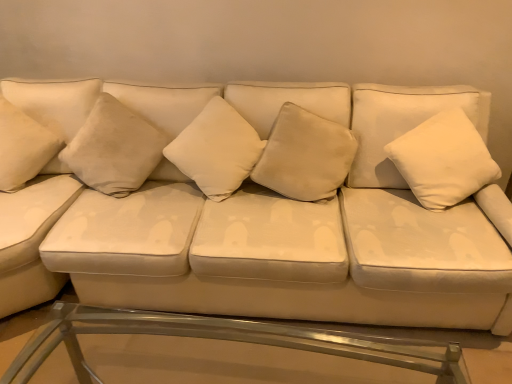
Question: From a real-world perspective, is suede-like beige pillow at center, the fourth pillow from the right, physically below suede white couch at center?

Choices:
 (A) no
 (B) yes

Answer: (A)

Question: Is suede-like beige pillow at center, which appears as the 2th pillow when viewed from the left, shorter than suede white couch at center?

Choices:
 (A) no
 (B) yes

Answer: (B)

Question: Is suede-like beige pillow at center, which appears as the 2th pillow when viewed from the left, closer to the viewer compared to suede white couch at center?

Choices:
 (A) no
 (B) yes

Answer: (A)

Question: Is suede-like beige pillow at center, which appears as the 2th pillow when viewed from the left, bigger than suede white couch at center?

Choices:
 (A) no
 (B) yes

Answer: (A)

Question: Is suede-like beige pillow at center, the fourth pillow from the right, turned away from suede white couch at center?

Choices:
 (A) no
 (B) yes

Answer: (B)

Question: Considering the positions of point (146, 301) and point (237, 114), is point (146, 301) closer or farther from the camera than point (237, 114)?

Choices:
 (A) farther
 (B) closer

Answer: (B)

Question: In terms of width, does suede white couch at center look wider or thinner when compared to white soft cushion at center, the third pillow viewed from the right?

Choices:
 (A) wide
 (B) thin

Answer: (A)

Question: Considering the positions of suede white couch at center and white soft cushion at center, the third pillow viewed from the right, in the image, is suede white couch at center taller or shorter than white soft cushion at center, the third pillow viewed from the right,?

Choices:
 (A) tall
 (B) short

Answer: (A)

Question: Is suede white couch at center in front of or behind white soft cushion at center, the third pillow viewed from the right, in the image?

Choices:
 (A) front
 (B) behind

Answer: (A)

Question: Considering the positions of point (147, 129) and point (1, 177), is point (147, 129) closer or farther from the camera than point (1, 177)?

Choices:
 (A) closer
 (B) farther

Answer: (B)

Question: Considering their positions, is suede-like beige pillow at center, which appears as the 2th pillow when viewed from the left, located in front of or behind white velvety pillow at left, marked as the first pillow in a left-to-right arrangement?

Choices:
 (A) behind
 (B) front

Answer: (A)

Question: From the image's perspective, is suede-like beige pillow at center, the fourth pillow from the right, positioned above or below white velvety pillow at left, the fifth pillow positioned from the right?

Choices:
 (A) below
 (B) above

Answer: (A)

Question: From a real-world perspective, is suede-like beige pillow at center, the fourth pillow from the right, positioned above or below white velvety pillow at left, the fifth pillow positioned from the right?

Choices:
 (A) above
 (B) below

Answer: (B)

Question: From a real-world perspective, is white velvety pillow at right, the first pillow in the right-to-left sequence, above or below suede-like beige pillow at center, which appears as the 2th pillow when viewed from the left?

Choices:
 (A) below
 (B) above

Answer: (B)

Question: In terms of size, does white velvety pillow at right, which appears as the 5th pillow when viewed from the left, appear bigger or smaller than suede-like beige pillow at center, which appears as the 2th pillow when viewed from the left?

Choices:
 (A) big
 (B) small

Answer: (A)